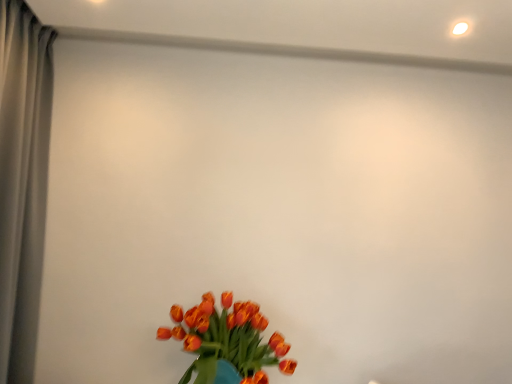
Question: Can you confirm if orange matte tulips at lower center is positioned to the left of gray fabric curtain at left?

Choices:
 (A) no
 (B) yes

Answer: (A)

Question: Does orange matte tulips at lower center have a greater height compared to gray fabric curtain at left?

Choices:
 (A) no
 (B) yes

Answer: (A)

Question: From a real-world perspective, does orange matte tulips at lower center sit lower than gray fabric curtain at left?

Choices:
 (A) no
 (B) yes

Answer: (B)

Question: Does orange matte tulips at lower center have a lesser width compared to gray fabric curtain at left?

Choices:
 (A) no
 (B) yes

Answer: (A)

Question: Is orange matte tulips at lower center shorter than gray fabric curtain at left?

Choices:
 (A) no
 (B) yes

Answer: (B)

Question: From a real-world perspective, is orange matte tulips at lower center over gray fabric curtain at left?

Choices:
 (A) yes
 (B) no

Answer: (B)

Question: Can you confirm if gray fabric curtain at left is thinner than orange matte tulips at lower center?

Choices:
 (A) no
 (B) yes

Answer: (B)

Question: Does gray fabric curtain at left have a greater width compared to orange matte tulips at lower center?

Choices:
 (A) no
 (B) yes

Answer: (A)

Question: From the image's perspective, would you say gray fabric curtain at left is positioned over orange matte tulips at lower center?

Choices:
 (A) no
 (B) yes

Answer: (B)

Question: From a real-world perspective, is gray fabric curtain at left beneath orange matte tulips at lower center?

Choices:
 (A) no
 (B) yes

Answer: (A)

Question: Is gray fabric curtain at left smaller than orange matte tulips at lower center?

Choices:
 (A) yes
 (B) no

Answer: (B)

Question: Is gray fabric curtain at left closer to camera compared to orange matte tulips at lower center?

Choices:
 (A) no
 (B) yes

Answer: (B)

Question: From the image's perspective, is gray fabric curtain at left located above or below orange matte tulips at lower center?

Choices:
 (A) above
 (B) below

Answer: (A)